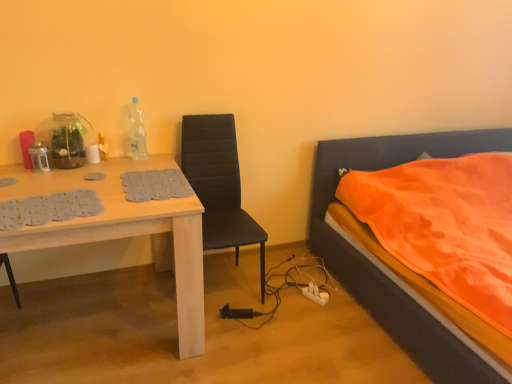
Where is `free space that is in between black leather chair at center and white plastic power outlet at lower center`? The width and height of the screenshot is (512, 384). free space that is in between black leather chair at center and white plastic power outlet at lower center is located at coordinates (283, 296).